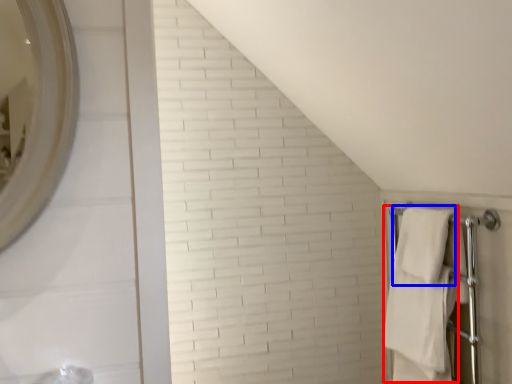
Question: Among these objects, which one is nearest to the camera, bath towel (highlighted by a red box) or bath towel (highlighted by a blue box)?

Choices:
 (A) bath towel
 (B) bath towel

Answer: (B)